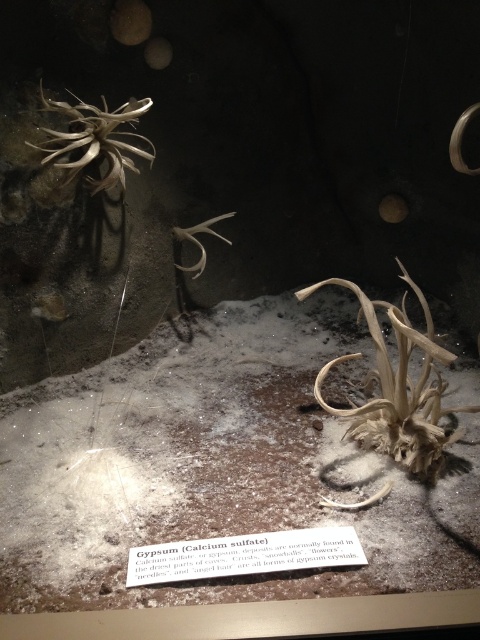
You are an archaeologist examining the display case. You need to determine the spatial relationship between the fibrous beige plant at center and the light brown textured plant at upper left. Which one is located to the right of the other?

The fibrous beige plant at center is positioned on the right side of light brown textured plant at upper left.

You are an explorer in a cave and see the fibrous beige plant at center and the light brown textured plant at upper left. Which one is nearer to you?

The fibrous beige plant at center is closer to the viewer than the light brown textured plant at upper left.

What is located at the point with coordinates (396, 387) in the display case?

A fibrous beige plant at center is located at point (396, 387) in the display case.